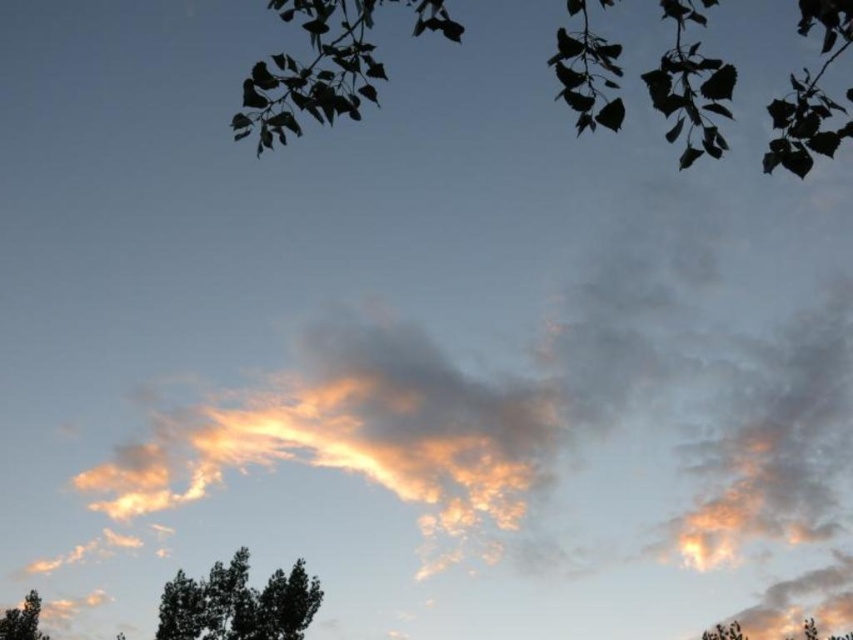
Question: Can you confirm if black matte tree at lower left is positioned below green leafy tree at bottom right?

Choices:
 (A) yes
 (B) no

Answer: (A)

Question: Among these objects, which one is nearest to the camera?

Choices:
 (A) green leafy tree at bottom right
 (B) green leafy tree at lower left

Answer: (A)

Question: Estimate the real-world distances between objects in this image. Which object is farther from the green leafy tree at lower left?

Choices:
 (A) black matte tree at lower left
 (B) silvery leaves at upper center

Answer: (B)

Question: Does silvery leaves at upper center have a smaller size compared to green leafy tree at bottom right?

Choices:
 (A) no
 (B) yes

Answer: (B)

Question: Which of the following is the closest to the observer?

Choices:
 (A) black matte tree at lower left
 (B) green leafy tree at bottom right
 (C) green leafy tree at lower left

Answer: (B)

Question: Does silvery leaves at upper center have a larger size compared to green leafy tree at lower left?

Choices:
 (A) no
 (B) yes

Answer: (A)